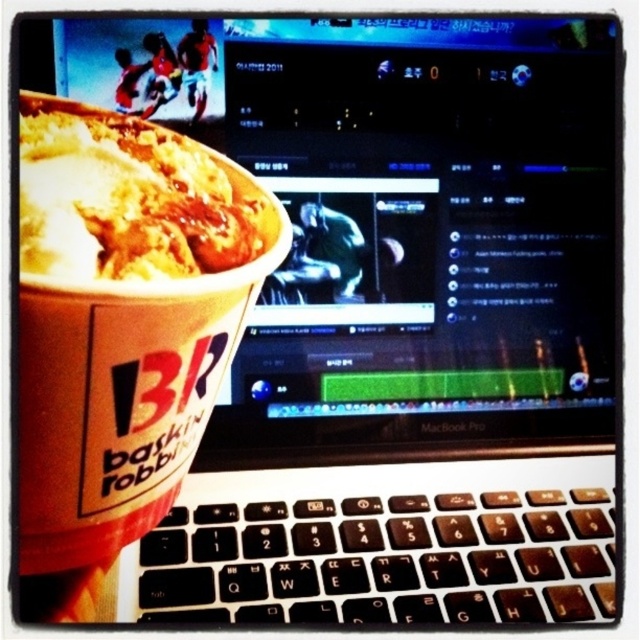
You are a delivery person who needs to place a small package on the desk where the laptop is located. The package is 12 inches long. Can you fit the package between the black plastic keyboard at center and the white creamy ice cream at left without moving either object?

The black plastic keyboard at center and the white creamy ice cream at left are 12.07 inches apart from each other. Since the package is 12 inches long, it can fit between them as the distance is slightly larger than the package length.

You are trying to type on the black plastic keyboard at center but your hand is brushing against the white creamy ice cream at left. Which object is taller and might be causing the obstruction?

The white creamy ice cream at left is taller than the black plastic keyboard at center, so it might be causing the obstruction.

You have a small container that can only hold items smaller than the white creamy ice cream at left. Can the black plastic keyboard at center fit into the container?

The black plastic keyboard at center is larger in size than the white creamy ice cream at left, so it cannot fit into the container designed for items smaller than the ice cream.